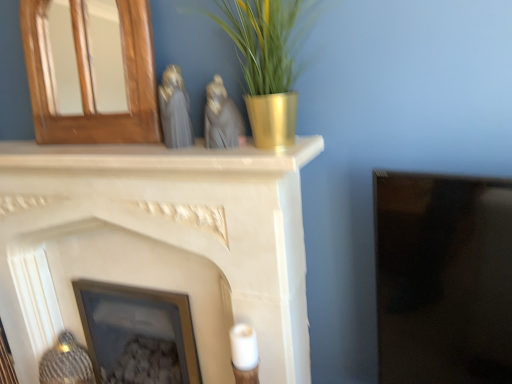
Locate an element on the screen. free region on the left part of satin gray statue at center, which appears as the 2th animal when viewed from the right is located at coordinates (134, 144).